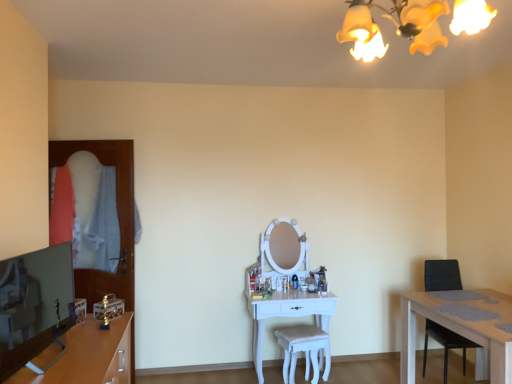
Identify the location of black leather chair at right. The width and height of the screenshot is (512, 384). (445, 344).

Locate an element on the screen. This screenshot has width=512, height=384. matte wooden tv stand at lower left is located at coordinates (90, 355).

Considering the points (115, 379) and (286, 311), which point is behind, point (115, 379) or point (286, 311)?

The point (286, 311) is more distant.

From a real-world perspective, is matte wooden tv stand at lower left above or below white glossy vanity at center?

matte wooden tv stand at lower left is above white glossy vanity at center.

Which is more to the right, matte wooden tv stand at lower left or white glossy vanity at center?

Positioned to the right is white glossy vanity at center.

Considering the relative sizes of matte wooden tv stand at lower left and white glossy vanity at center in the image provided, is matte wooden tv stand at lower left shorter than white glossy vanity at center?

Yes.

Which of these two, black leather chair at right or white fabric stool at center, is thinner?

white fabric stool at center.

Can you tell me how much black leather chair at right and white fabric stool at center differ in facing direction?

19.3 degrees.

Is point (459, 280) closer or farther from the camera than point (311, 353)?

Point (459, 280) is farther from the camera than point (311, 353).

Is white fabric stool at center surrounded by black leather chair at right?

No, white fabric stool at center is not inside black leather chair at right.

From a real-world perspective, between matte wooden tv stand at lower left and black leather chair at right, who is vertically higher?

matte wooden tv stand at lower left is physically above.

From the image's perspective, is matte wooden tv stand at lower left located above or below black leather chair at right?

Based on their image positions, matte wooden tv stand at lower left is located above black leather chair at right.

Can we say matte wooden tv stand at lower left lies outside black leather chair at right?

matte wooden tv stand at lower left lies outside black leather chair at right's area.

Is white glossy vanity at center aimed at matte wooden tv stand at lower left?

No.

How many degrees apart are the facing directions of white glossy vanity at center and matte wooden tv stand at lower left?

They differ by 90.6 degrees in their facing directions.

From a real-world perspective, is white glossy vanity at center physically located above or below matte wooden tv stand at lower left?

white glossy vanity at center is below matte wooden tv stand at lower left.

How distant is white glossy vanity at center from matte wooden tv stand at lower left?

A distance of 5.19 feet exists between white glossy vanity at center and matte wooden tv stand at lower left.

Does white glossy vanity at center have a greater height compared to black leather chair at right?

In fact, white glossy vanity at center may be shorter than black leather chair at right.

Is white glossy vanity at center placed right next to black leather chair at right?

white glossy vanity at center and black leather chair at right are clearly separated.

Is white glossy vanity at center oriented towards black leather chair at right?

No, white glossy vanity at center is not facing towards black leather chair at right.

From the image's perspective, is white glossy vanity at center above or below black leather chair at right?

white glossy vanity at center is situated lower than black leather chair at right in the image.

Would you say yellow fabric lampshade at upper center is part of white fabric stool at center's contents?

Definitely not — yellow fabric lampshade at upper center is not inside white fabric stool at center.

Which of these two, white fabric stool at center or yellow fabric lampshade at upper center, stands taller?

white fabric stool at center.

From the image's perspective, which one is positioned lower, white fabric stool at center or yellow fabric lampshade at upper center?

white fabric stool at center.

From a real-world perspective, between yellow fabric lampshade at upper center and white glossy vanity at center, who is vertically lower?

From a 3D spatial view, white glossy vanity at center is below.

Is point (346, 17) positioned after point (327, 310)?

No, (346, 17) is in front of (327, 310).

From the image's perspective, is yellow fabric lampshade at upper center over white glossy vanity at center?

Yes.

Which object is further away from the camera, yellow fabric lampshade at upper center or white glossy vanity at center?

white glossy vanity at center is further from the camera.

This screenshot has height=384, width=512. In order to click on cabinetry above the white glossy vanity at center (from a real-world perspective) in this screenshot , I will do `click(90, 355)`.

You are a GUI agent. You are given a task and a screenshot of the screen. Output one action in this format:
    pyautogui.click(x=<x>, y=<y>)
    Task: Click on the chair on the right of white fabric stool at center
    Image resolution: width=512 pixels, height=384 pixels.
    Given the screenshot: What is the action you would take?
    pyautogui.click(x=445, y=344)

Which object lies nearer to the anchor point white fabric stool at center, matte wooden tv stand at lower left or yellow fabric lampshade at upper center?

Based on the image, matte wooden tv stand at lower left appears to be nearer to white fabric stool at center.

When comparing their distances from matte wooden tv stand at lower left, does white glossy vanity at center or black leather chair at right seem closer?

white glossy vanity at center lies closer to matte wooden tv stand at lower left than the other object.

When comparing their distances from yellow fabric lampshade at upper center, does black leather chair at right or white fabric stool at center seem further?

Based on the image, black leather chair at right appears to be further to yellow fabric lampshade at upper center.

Based on their spatial positions, is yellow fabric lampshade at upper center or matte wooden tv stand at lower left closer to white fabric stool at center?

matte wooden tv stand at lower left is positioned closer to the anchor white fabric stool at center.

Which object lies further to the anchor point yellow fabric lampshade at upper center, white fabric stool at center or matte wooden tv stand at lower left?

white fabric stool at center is positioned further to the anchor yellow fabric lampshade at upper center.

When comparing their distances from matte wooden tv stand at lower left, does black leather chair at right or white glossy vanity at center seem closer?

white glossy vanity at center.

From the image, which object appears to be nearer to white glossy vanity at center, yellow fabric lampshade at upper center or matte wooden tv stand at lower left?

matte wooden tv stand at lower left.

Based on their spatial positions, is white glossy vanity at center or yellow fabric lampshade at upper center further from black leather chair at right?

yellow fabric lampshade at upper center is positioned further to the anchor black leather chair at right.

Find the location of `chair between yellow fabric lampshade at upper center and white glossy vanity at center in the front-back direction`. chair between yellow fabric lampshade at upper center and white glossy vanity at center in the front-back direction is located at coordinates (445, 344).

Where is `stool between matte wooden tv stand at lower left and black leather chair at right`? Image resolution: width=512 pixels, height=384 pixels. stool between matte wooden tv stand at lower left and black leather chair at right is located at coordinates (303, 350).

You are a GUI agent. You are given a task and a screenshot of the screen. Output one action in this format:
    pyautogui.click(x=<x>, y=<y>)
    Task: Click on the light fixture between matte wooden tv stand at lower left and black leather chair at right from left to right
    This screenshot has width=512, height=384.
    Given the screenshot: What is the action you would take?
    pyautogui.click(x=395, y=24)

I want to click on stool located between white glossy vanity at center and black leather chair at right in the left-right direction, so click(x=303, y=350).